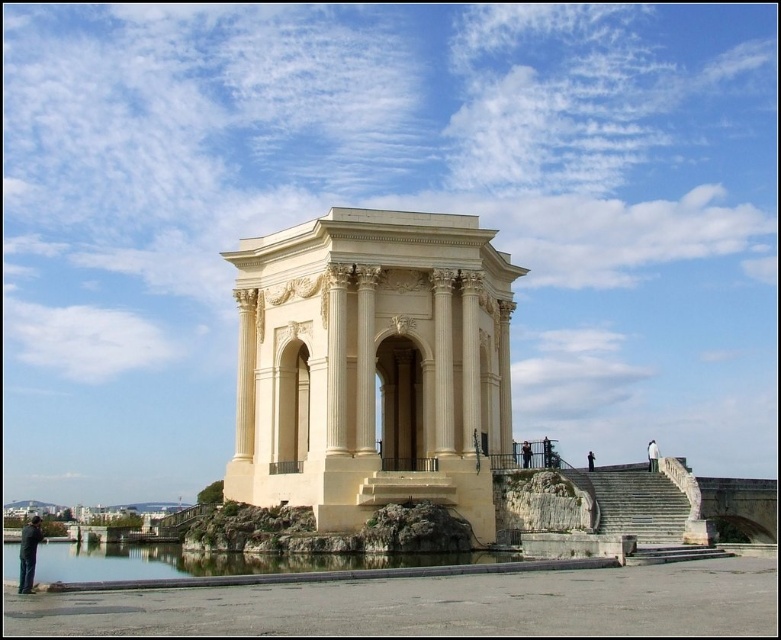
Locate an element on the screen. white marble monument at center is located at coordinates (373, 365).

Measure the distance between white marble monument at center and black leather pants at lower left.

white marble monument at center is 27.58 meters away from black leather pants at lower left.

What do you see at coordinates (373, 365) in the screenshot? The image size is (781, 640). I see `white marble monument at center` at bounding box center [373, 365].

This screenshot has width=781, height=640. What are the coordinates of `white marble monument at center` in the screenshot? It's located at (373, 365).

Who is shorter, clear water at lower center or white stone person at right?

clear water at lower center

Does point (137, 557) lie behind point (651, 440)?

No, (137, 557) is in front of (651, 440).

This screenshot has width=781, height=640. I want to click on clear water at lower center, so click(x=216, y=561).

Does white stone person at right have a lesser width compared to black fabric person at upper center?

In fact, white stone person at right might be wider than black fabric person at upper center.

Between white stone person at right and black fabric person at upper center, which one is positioned lower?

black fabric person at upper center is lower down.

Is point (648, 452) in front of point (590, 458)?

Yes, it is.

The width and height of the screenshot is (781, 640). What are the coordinates of `white stone person at right` in the screenshot? It's located at (651, 456).